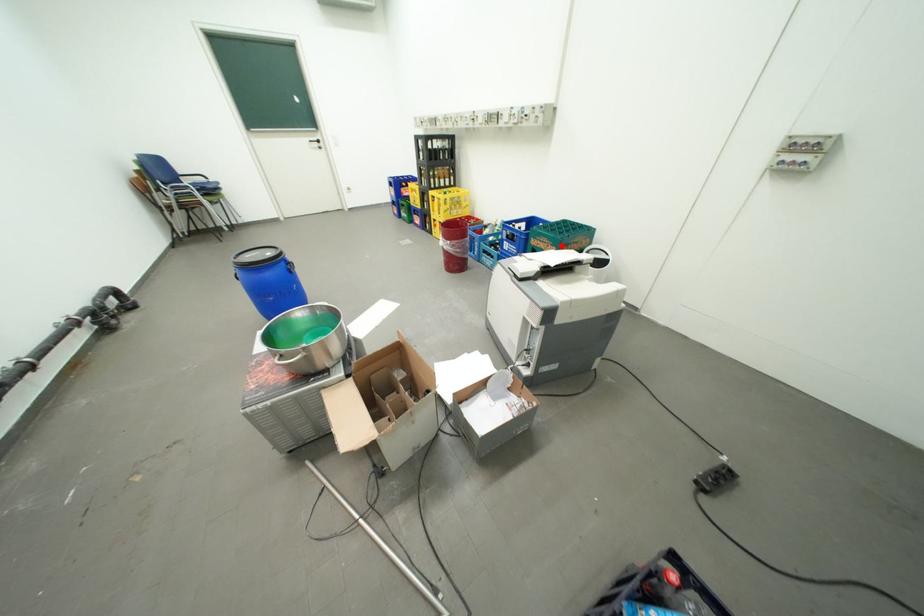
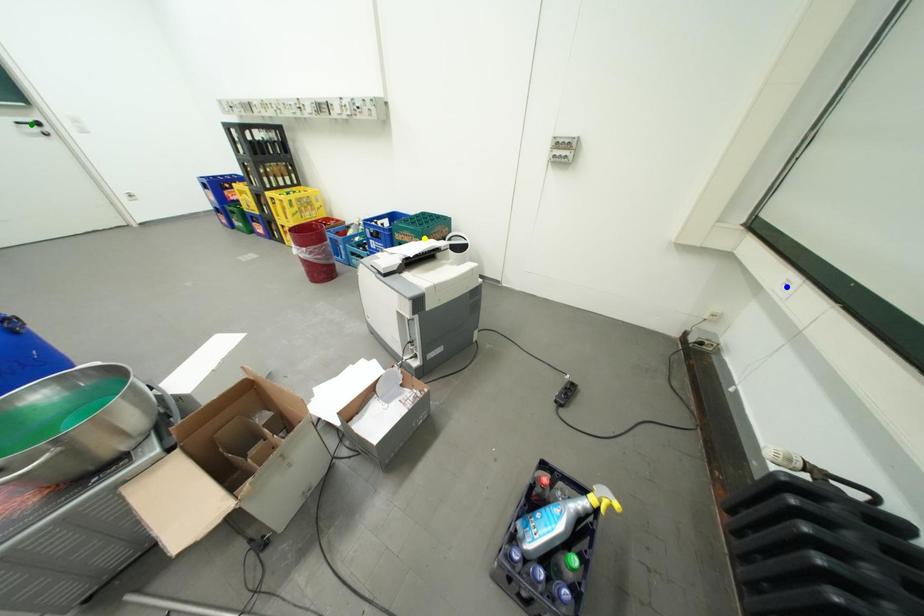
Question: I am providing you with two images of the same scene from different viewpoints. A red point is marked on the first image. You are given multiple points on the second image. Which point in image 2 is actually the same real-world point as the red point in image 1?

Choices:
 (A) green point
 (B) yellow point
 (C) blue point

Answer: (B)